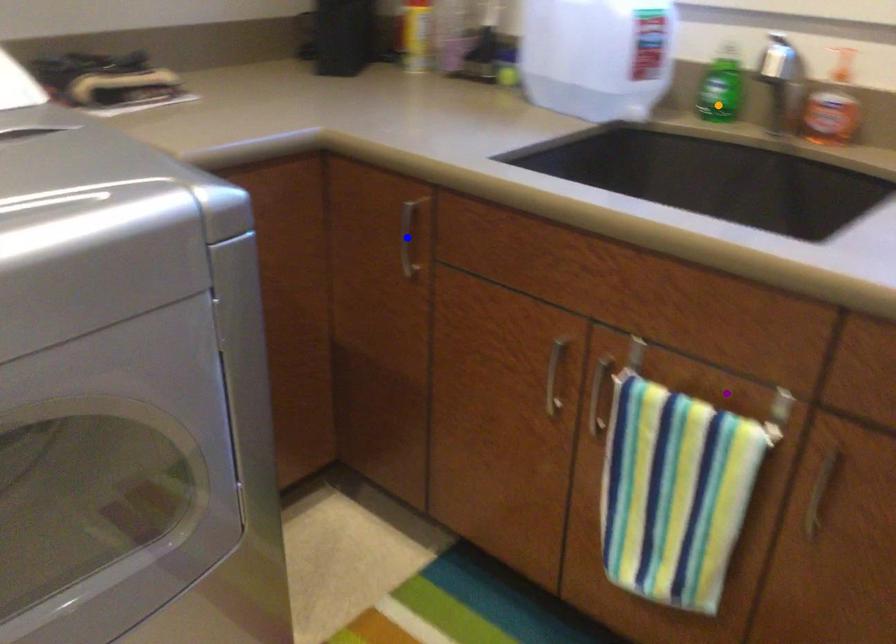
In the scene shown: Order these from nearest to farthest:
purple point, blue point, orange point

1. purple point
2. blue point
3. orange point